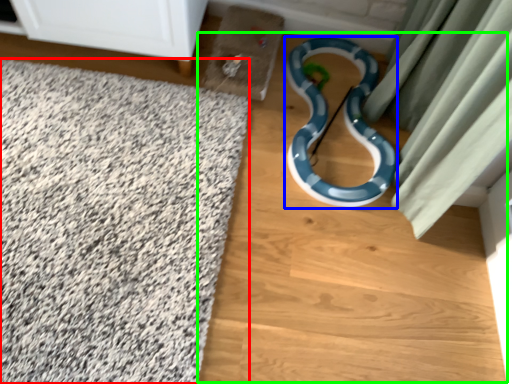
Question: Estimate the real-world distances between objects in this image. Which object is closer to bath mat (highlighted by a red box), snake (highlighted by a blue box) or dirt track (highlighted by a green box)?

Choices:
 (A) snake
 (B) dirt track

Answer: (B)